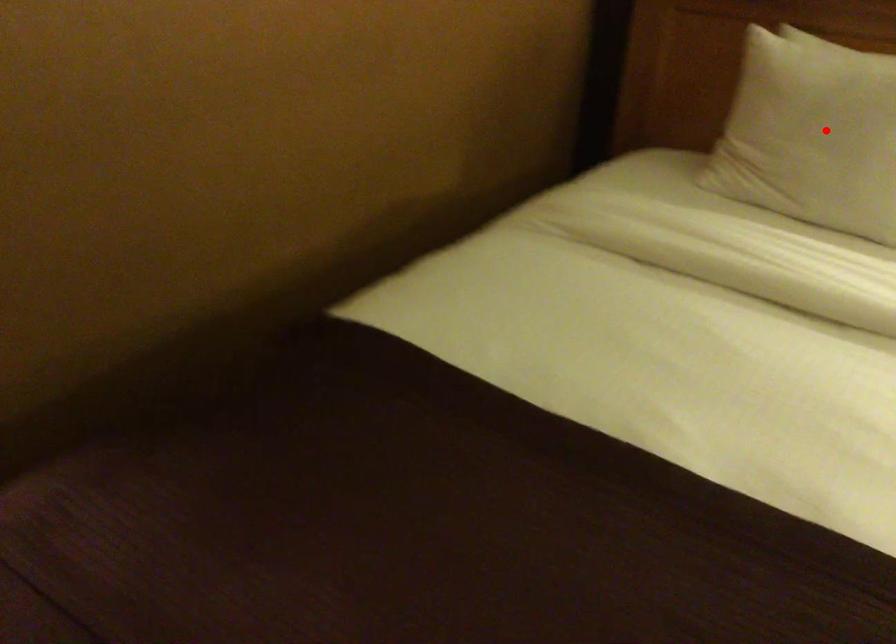
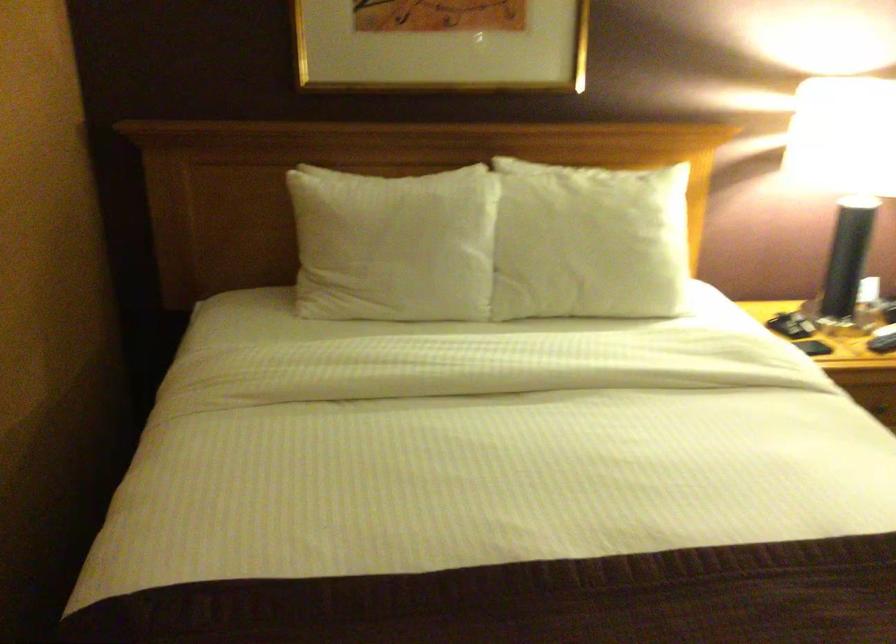
Question: I am providing you with two images of the same scene from different viewpoints. A red point is shown in image1. For the corresponding object point in image2, is it positioned nearer or farther from the camera?

Choices:
 (A) Nearer
 (B) Farther

Answer: (B)